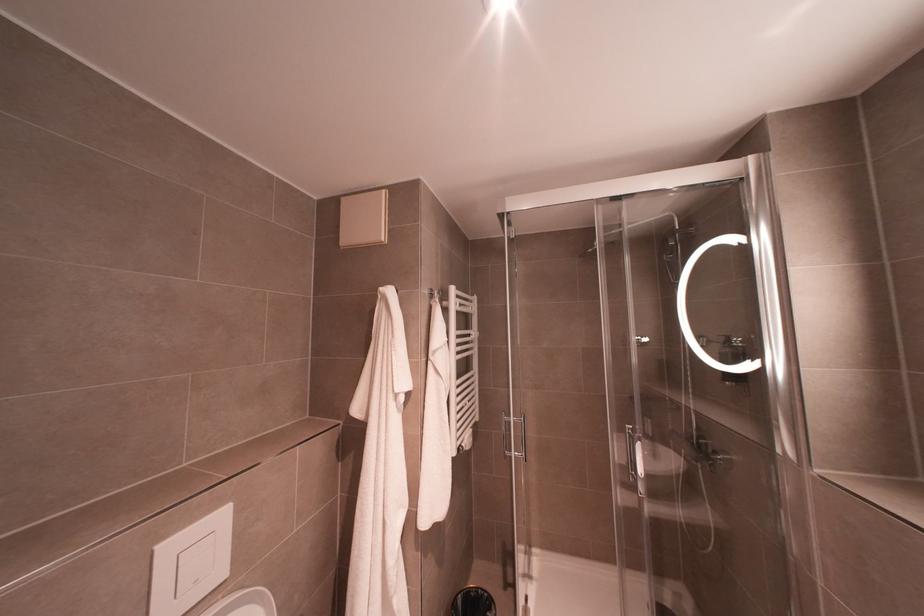
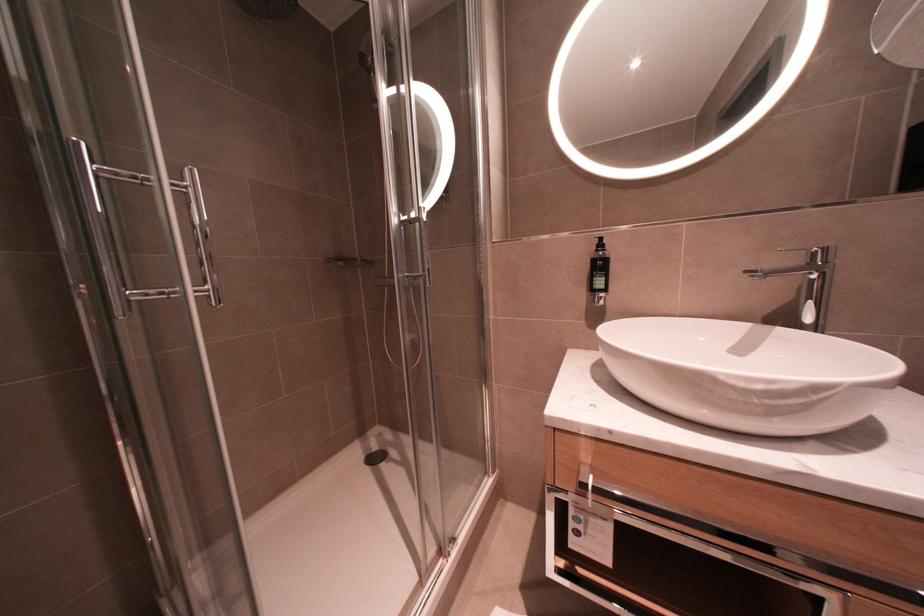
Question: The first image is from the beginning of the video and the second image is from the end. How did the camera likely rotate when shooting the video?

Choices:
 (A) Left
 (B) Right
 (C) Up
 (D) Down

Answer: (B)